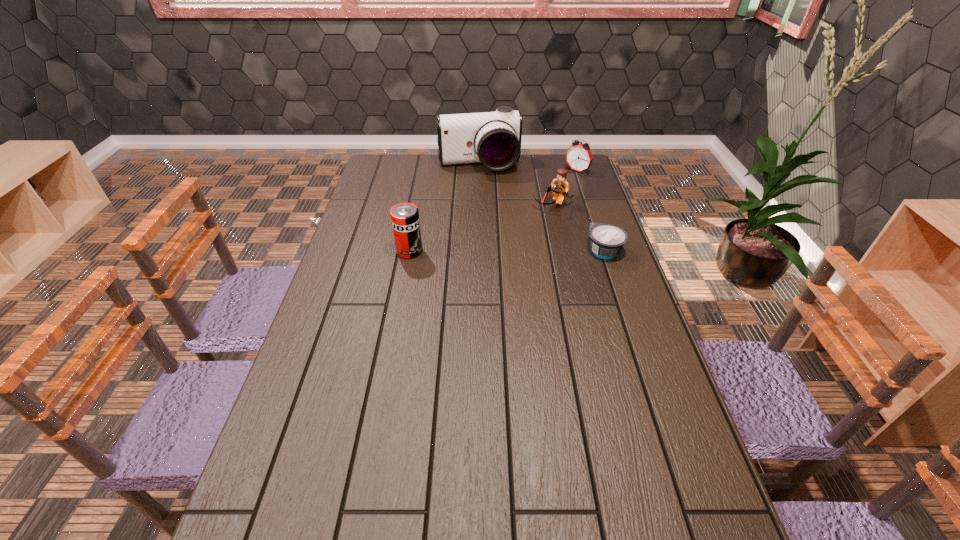
The image size is (960, 540). Identify the location of free space between the yogurt and the Lego. (579, 228).

You are a GUI agent. You are given a task and a screenshot of the screen. Output one action in this format:
    pyautogui.click(x=<x>, y=<y>)
    Task: Click on the free space between the yogurt and the Lego
    The width and height of the screenshot is (960, 540).
    Given the screenshot: What is the action you would take?
    pyautogui.click(x=579, y=228)

At what (x,y) coordinates should I click in order to perform the action: click on vacant area between the shortest object and the camcorder. Please return your answer as a coordinate pair (x, y). The height and width of the screenshot is (540, 960). Looking at the image, I should click on (541, 208).

Identify the location of vacant point located between the fourth object from right to left and the shortest object. This screenshot has height=540, width=960. (541, 208).

Locate an element on the screen. free spot between the second tallest object and the fourth object from right to left is located at coordinates (444, 208).

The height and width of the screenshot is (540, 960). I want to click on vacant area that lies between the yogurt and the tallest object, so click(x=541, y=208).

Locate an element on the screen. free space that is in between the shortest object and the alarm clock is located at coordinates (590, 211).

The width and height of the screenshot is (960, 540). Find the location of `free spot between the yogurt and the third farthest object`. free spot between the yogurt and the third farthest object is located at coordinates (579, 228).

Identify which object is the nearest to the alarm clock. Please provide its 2D coordinates. Your answer should be formatted as a tuple, i.e. [(x, y)], where the tuple contains the x and y coordinates of a point satisfying the conditions above.

[(560, 186)]

Locate which object is the third closest to the shortest object. Please provide its 2D coordinates. Your answer should be formatted as a tuple, i.e. [(x, y)], where the tuple contains the x and y coordinates of a point satisfying the conditions above.

[(492, 138)]